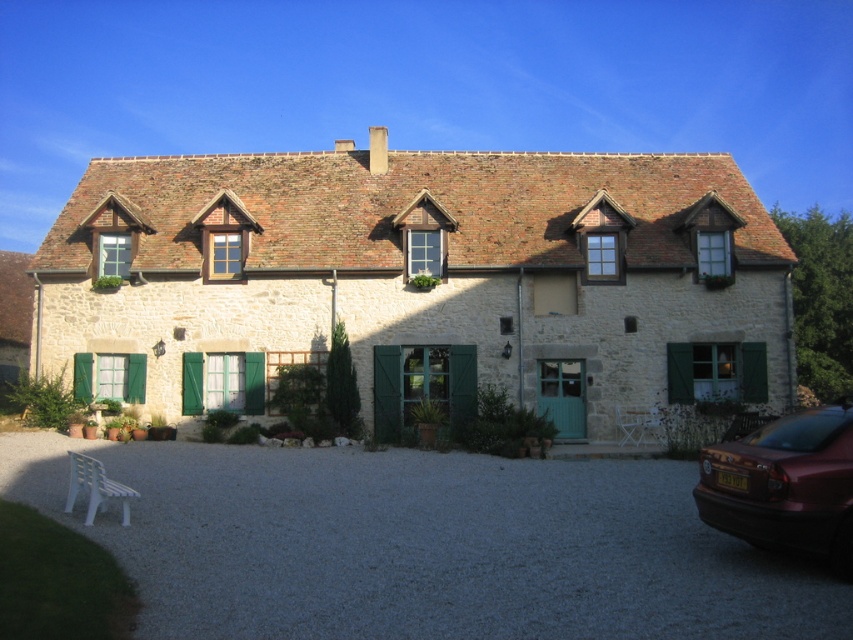
Is point (206, 381) more distant than point (430, 246)?

No, (206, 381) is in front of (430, 246).

Does green matte shutter at lower left appear under green matte shutter at center?

Indeed, green matte shutter at lower left is positioned under green matte shutter at center.

Image resolution: width=853 pixels, height=640 pixels. What are the coordinates of `green matte shutter at lower left` in the screenshot? It's located at (235, 381).

You are a GUI agent. You are given a task and a screenshot of the screen. Output one action in this format:
    pyautogui.click(x=<x>, y=<y>)
    Task: Click on the green matte shutter at lower left
    This screenshot has width=853, height=640.
    Given the screenshot: What is the action you would take?
    pyautogui.click(x=235, y=381)

Is gray gravel driveway at center above green matte shutter at lower left?

Incorrect, gray gravel driveway at center is not positioned above green matte shutter at lower left.

Does gray gravel driveway at center have a smaller size compared to green matte shutter at lower left?

Actually, gray gravel driveway at center might be larger than green matte shutter at lower left.

Where is `gray gravel driveway at center`? This screenshot has height=640, width=853. gray gravel driveway at center is located at coordinates (422, 545).

Is green matte shutter at lower left thinner than green wooden shutter at upper center?

No.

Is green matte shutter at lower left taller than green wooden shutter at upper center?

Correct, green matte shutter at lower left is much taller as green wooden shutter at upper center.

Who is more distant from viewer, (x=248, y=358) or (x=602, y=243)?

Positioned behind is point (x=602, y=243).

Find the location of `green matte shutter at lower left`. green matte shutter at lower left is located at coordinates (235, 381).